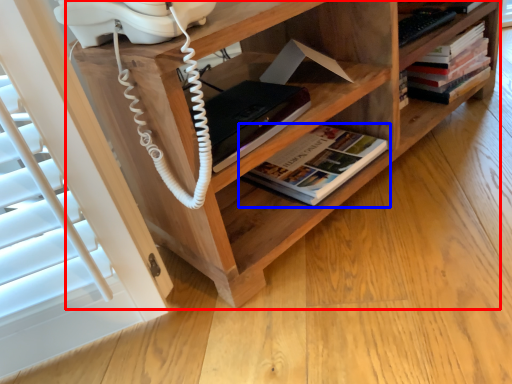
Question: Which point is further to the camera, shelf (highlighted by a red box) or book (highlighted by a blue box)?

Choices:
 (A) shelf
 (B) book

Answer: (B)